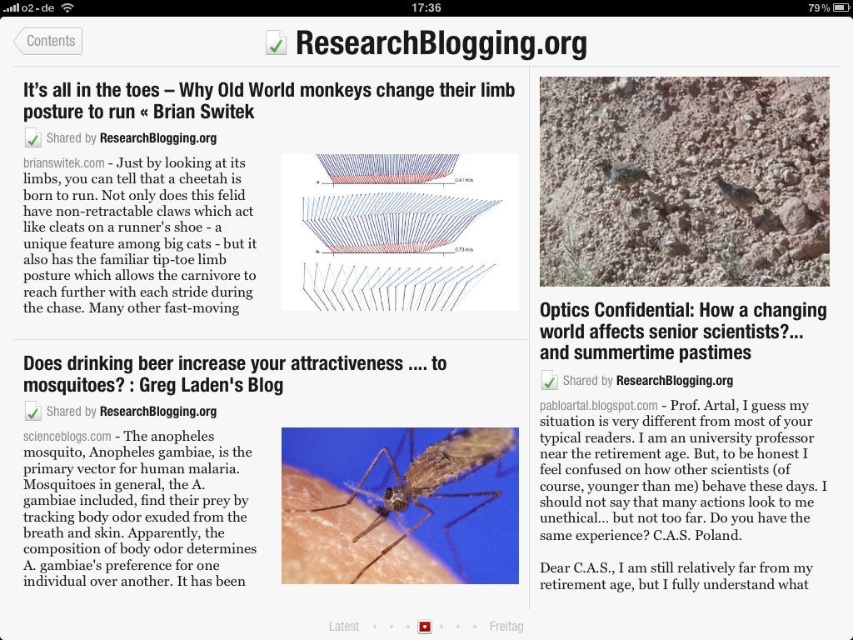
Can you confirm if translucent brown mosquito at center is bigger than matte brown mosquito at center?

Yes.

Does translucent brown mosquito at center lie behind matte brown mosquito at center?

No.

Does point (380, 461) lie in front of point (732, 186)?

That is True.

Locate an element on the screen. Image resolution: width=853 pixels, height=640 pixels. translucent brown mosquito at center is located at coordinates (399, 504).

Does point (479, 474) lie in front of point (634, 177)?

Yes, it is.

Who is more forward, (410, 550) or (630, 170)?

Point (410, 550)

Between point (368, 508) and point (624, 180), which one is positioned behind?

Positioned behind is point (624, 180).

Locate an element on the screen. The height and width of the screenshot is (640, 853). translucent brown mosquito at center is located at coordinates click(x=399, y=504).

Is brown fuzzy mosquito at center taller than matte brown mosquito at center?

No, brown fuzzy mosquito at center is not taller than matte brown mosquito at center.

Is brown fuzzy mosquito at center further to camera compared to matte brown mosquito at center?

Yes, brown fuzzy mosquito at center is further from the viewer.

Describe the element at coordinates (622, 173) in the screenshot. I see `brown fuzzy mosquito at center` at that location.

Locate an element on the screen. The height and width of the screenshot is (640, 853). brown fuzzy mosquito at center is located at coordinates (622, 173).